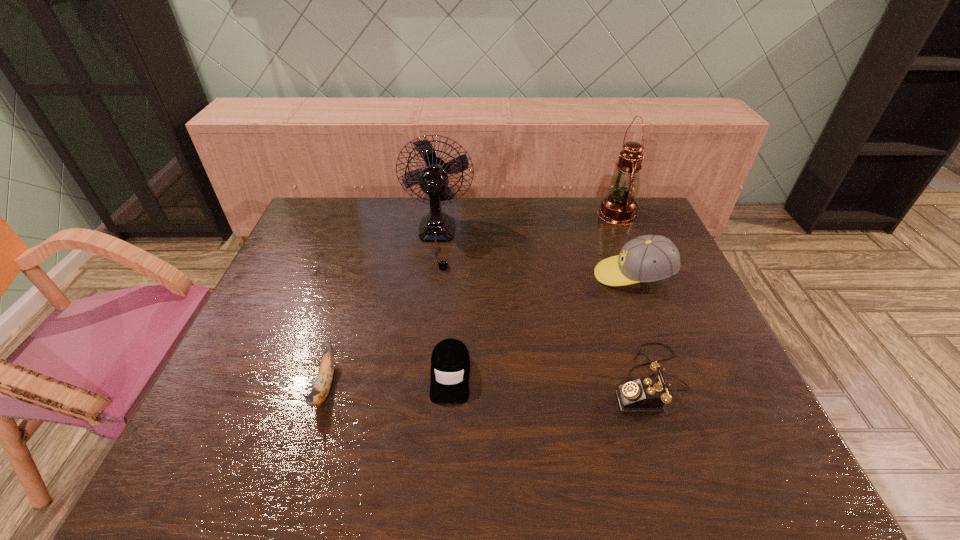
Locate an element on the screen. Image resolution: width=960 pixels, height=540 pixels. free spot between the shortest object and the oil lamp is located at coordinates (534, 294).

Locate an element on the screen. This screenshot has width=960, height=540. free space between the fan and the telephone is located at coordinates (542, 309).

The width and height of the screenshot is (960, 540). I want to click on vacant region between the oil lamp and the leftmost object, so click(x=471, y=300).

Identify the location of vacant point located between the leftmost object and the fourth shortest object. (479, 331).

Image resolution: width=960 pixels, height=540 pixels. What are the coordinates of `free area in between the leftmost object and the telephone` in the screenshot? It's located at (487, 383).

I want to click on free spot between the cap and the leftmost object, so click(388, 381).

The width and height of the screenshot is (960, 540). I want to click on the second closest object relative to the oil lamp, so click(437, 226).

Where is `object that is the third closest to the fan`? object that is the third closest to the fan is located at coordinates (649, 258).

The image size is (960, 540). Identify the location of free space in the image that satisfies the following two spatial constraints: 1. on the front side of the oil lamp; 2. on the front-facing side of the baseball cap. (642, 275).

Image resolution: width=960 pixels, height=540 pixels. I want to click on free space that satisfies the following two spatial constraints: 1. on the front-facing side of the baseball cap; 2. on the peel of the leftmost object, so click(x=676, y=386).